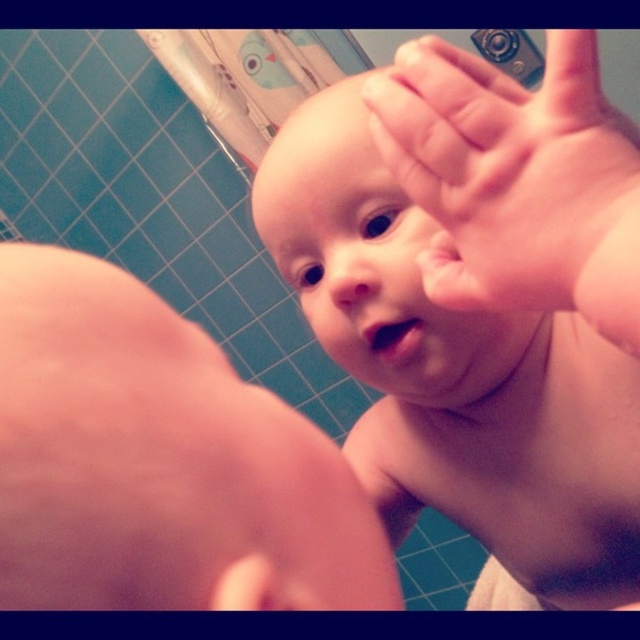
Does pink flesh baby at center have a lesser height compared to pink flesh at lower left?

In fact, pink flesh baby at center may be taller than pink flesh at lower left.

You are a GUI agent. You are given a task and a screenshot of the screen. Output one action in this format:
    pyautogui.click(x=<x>, y=<y>)
    Task: Click on the pink flesh baby at center
    Image resolution: width=640 pixels, height=640 pixels.
    Given the screenshot: What is the action you would take?
    pyautogui.click(x=480, y=301)

Is pink flesh baby at center behind pink flesh hand at upper center?

That is True.

The width and height of the screenshot is (640, 640). What do you see at coordinates (480, 301) in the screenshot? I see `pink flesh baby at center` at bounding box center [480, 301].

The width and height of the screenshot is (640, 640). What are the coordinates of `pink flesh baby at center` in the screenshot? It's located at (480, 301).

Does pink flesh at lower left appear over pink flesh hand at upper center?

No, pink flesh at lower left is not above pink flesh hand at upper center.

Where is `pink flesh at lower left`? pink flesh at lower left is located at coordinates (156, 458).